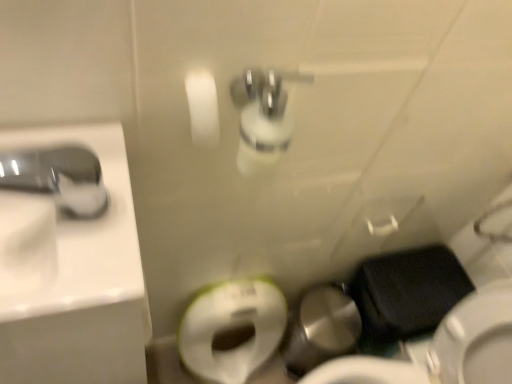
Where is `white glossy sink at left`? white glossy sink at left is located at coordinates (72, 274).

Can you confirm if satin nickel faucet at upper left is wider than black matte wallet at lower right?

No.

Can you confirm if satin nickel faucet at upper left is shorter than black matte wallet at lower right?

Indeed, satin nickel faucet at upper left has a lesser height compared to black matte wallet at lower right.

This screenshot has height=384, width=512. I want to click on sit below the satin nickel faucet at upper left (from the image's perspective), so click(x=407, y=292).

Considering their positions, is satin nickel faucet at upper left located in front of or behind black matte wallet at lower right?

Visually, satin nickel faucet at upper left is located in front of black matte wallet at lower right.

Is satin nickel faucet at upper left facing away from white glossy sink at left?

No, satin nickel faucet at upper left is not facing the opposite direction of white glossy sink at left.

From a real-world perspective, between satin nickel faucet at upper left and white glossy sink at left, who is vertically lower?

white glossy sink at left is physically lower.

Are satin nickel faucet at upper left and white glossy sink at left making contact?

No, satin nickel faucet at upper left is not with white glossy sink at left.

Which is behind, point (440, 253) or point (8, 254)?

The point (440, 253) is more distant.

Based on their positions, is black matte wallet at lower right located to the left or right of white glossy sink at left?

black matte wallet at lower right is to the right of white glossy sink at left.

From the image's perspective, which one is positioned lower, black matte wallet at lower right or white glossy sink at left?

black matte wallet at lower right.

Find the location of a particular element. This screenshot has height=384, width=512. sink above the black matte wallet at lower right (from the image's perspective) is located at coordinates (72, 274).

Considering the sizes of objects black matte wallet at lower right and satin nickel faucet at upper left in the image provided, who is bigger, black matte wallet at lower right or satin nickel faucet at upper left?

Bigger between the two is black matte wallet at lower right.

Is black matte wallet at lower right positioned with its back to satin nickel faucet at upper left?

No, black matte wallet at lower right's orientation is not away from satin nickel faucet at upper left.

How distant is black matte wallet at lower right from satin nickel faucet at upper left?

A distance of 91.39 centimeters exists between black matte wallet at lower right and satin nickel faucet at upper left.

Considering the relative sizes of black matte wallet at lower right and satin nickel faucet at upper left in the image provided, is black matte wallet at lower right wider than satin nickel faucet at upper left?

Correct, the width of black matte wallet at lower right exceeds that of satin nickel faucet at upper left.

Which object is closer to the camera, white glossy sink at left or black matte wallet at lower right?

white glossy sink at left is more forward.

Is white glossy sink at left wider than black matte wallet at lower right?

No.

What's the angular difference between white glossy sink at left and black matte wallet at lower right's facing directions?

white glossy sink at left and black matte wallet at lower right are facing 89.3 degrees away from each other.

Which of these two, white glossy sink at left or black matte wallet at lower right, stands taller?

Standing taller between the two is black matte wallet at lower right.

From a real-world perspective, is white glossy sink at left physically below satin nickel faucet at upper left?

Correct, in the physical world, white glossy sink at left is lower than satin nickel faucet at upper left.

Can you confirm if white glossy sink at left is shorter than satin nickel faucet at upper left?

In fact, white glossy sink at left may be taller than satin nickel faucet at upper left.

Is white glossy sink at left positioned with its back to satin nickel faucet at upper left?

No, white glossy sink at left is not facing away from satin nickel faucet at upper left.

You are a GUI agent. You are given a task and a screenshot of the screen. Output one action in this format:
    pyautogui.click(x=<x>, y=<y>)
    Task: Click on the sink that is under the satin nickel faucet at upper left (from a real-world perspective)
    
    Given the screenshot: What is the action you would take?
    pyautogui.click(x=72, y=274)

There is a black matte wallet at lower right. At what (x,y) coordinates should I click in order to perform the action: click on tap above it (from a real-world perspective). Please return your answer as a coordinate pair (x, y). Looking at the image, I should click on (58, 177).

Image resolution: width=512 pixels, height=384 pixels. In the image, there is a white glossy sink at left. Identify the location of tap above it (from the image's perspective). pyautogui.click(x=58, y=177).

Based on their spatial positions, is white glossy sink at left or satin nickel faucet at upper left further from black matte wallet at lower right?

Among the two, satin nickel faucet at upper left is located further to black matte wallet at lower right.

When comparing their distances from satin nickel faucet at upper left, does white glossy sink at left or black matte wallet at lower right seem further?

black matte wallet at lower right lies further to satin nickel faucet at upper left than the other object.

When comparing their distances from white glossy sink at left, does black matte wallet at lower right or satin nickel faucet at upper left seem closer?

satin nickel faucet at upper left is closer to white glossy sink at left.

Looking at the image, which one is located further to white glossy sink at left, satin nickel faucet at upper left or black matte wallet at lower right?

The object further to white glossy sink at left is black matte wallet at lower right.

When comparing their distances from black matte wallet at lower right, does satin nickel faucet at upper left or white glossy sink at left seem closer?

white glossy sink at left.

Considering their positions, is black matte wallet at lower right positioned further to satin nickel faucet at upper left than white glossy sink at left?

black matte wallet at lower right lies further to satin nickel faucet at upper left than the other object.

Locate an element on the screen. The image size is (512, 384). sink between satin nickel faucet at upper left and black matte wallet at lower right along the z-axis is located at coordinates (72, 274).